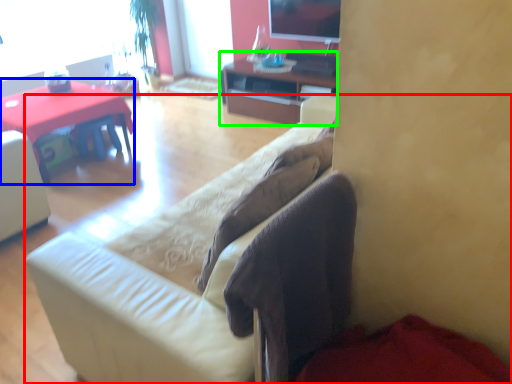
Question: Which object is positioned closest to studio couch (highlighted by a red box)? Select from desk (highlighted by a blue box) and cabinetry (highlighted by a green box).

Choices:
 (A) desk
 (B) cabinetry

Answer: (A)